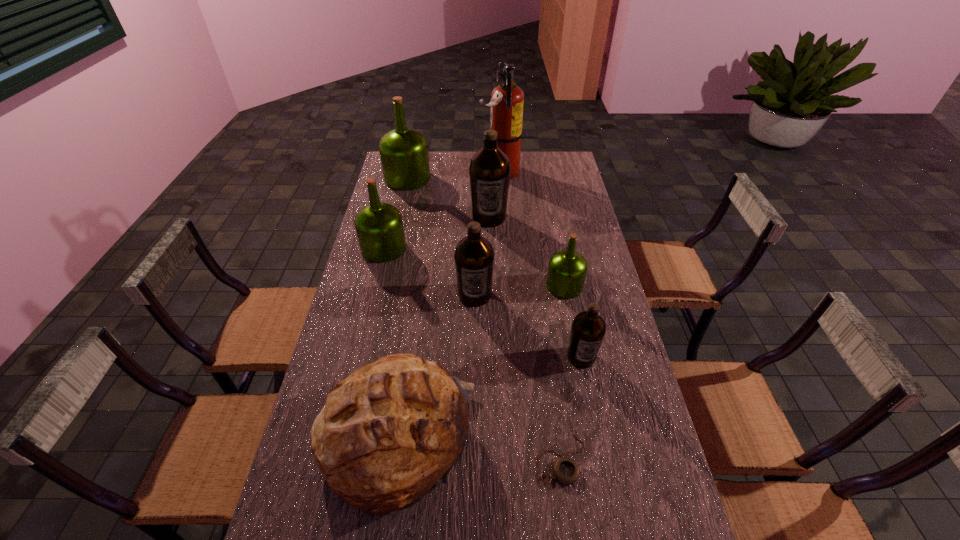
I want to click on the smallest brown olive oil, so click(x=588, y=328).

Locate an element on the screen. The width and height of the screenshot is (960, 540). the rightmost green olive oil is located at coordinates (567, 269).

Where is `the nearest green olive oil`? the nearest green olive oil is located at coordinates (567, 269).

Where is `bread`? bread is located at coordinates (389, 433).

Find the location of a particular element. The height and width of the screenshot is (540, 960). pocket watch is located at coordinates (566, 470).

In order to click on vacant space located from the nozzle of the fire extinguisher in this screenshot , I will do `click(403, 172)`.

The width and height of the screenshot is (960, 540). I want to click on vacant space situated 0.060m from the nozzle of the fire extinguisher, so click(x=467, y=172).

Where is `free location located 0.110m from the nozzle of the fire extinguisher`? This screenshot has height=540, width=960. free location located 0.110m from the nozzle of the fire extinguisher is located at coordinates [x=456, y=172].

Find the location of `vacant space located on the right of the biggest green olive oil`. vacant space located on the right of the biggest green olive oil is located at coordinates (506, 178).

Identify the location of vacant space located on the label of the seventh nearest object. The height and width of the screenshot is (540, 960). (490, 248).